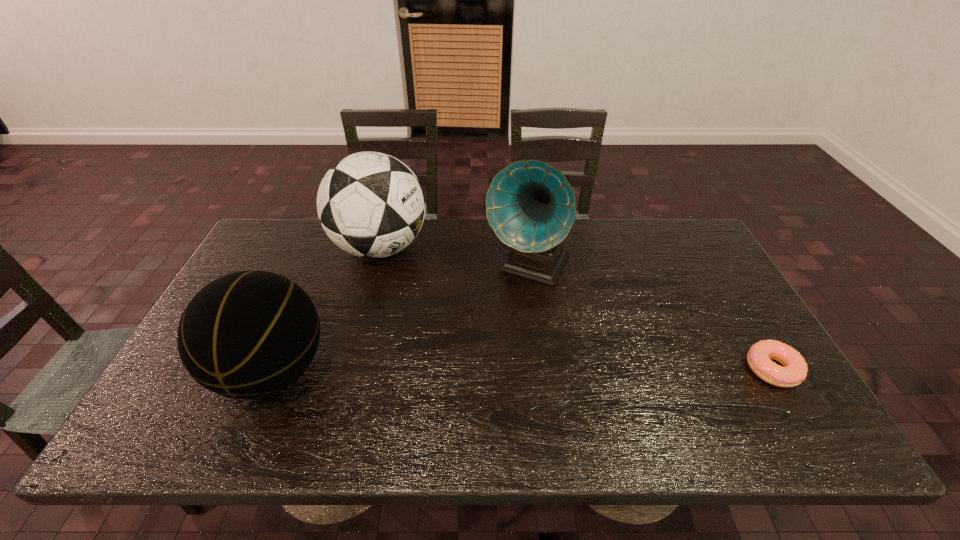
In order to click on free space located 0.260m from the horn of the tallest object in this screenshot , I will do `click(475, 363)`.

You are a GUI agent. You are given a task and a screenshot of the screen. Output one action in this format:
    pyautogui.click(x=<x>, y=<y>)
    Task: Click on the free region located on the surface of the soccer ball where the brand logo is visible
    
    Given the screenshot: What is the action you would take?
    pyautogui.click(x=427, y=312)

Where is `free region located 0.130m on the surface of the soccer ball where the brand logo is visible`? free region located 0.130m on the surface of the soccer ball where the brand logo is visible is located at coordinates (420, 301).

Locate an element on the screen. The image size is (960, 540). free space located 0.300m on the surface of the soccer ball where the brand logo is visible is located at coordinates (448, 340).

This screenshot has width=960, height=540. Identify the location of phonograph_record at the far edge. (530, 205).

Locate an element on the screen. soccer ball that is at the far edge is located at coordinates (371, 205).

Locate an element on the screen. basketball situated at the near edge is located at coordinates (250, 334).

Find the location of `doughnut situated at the near edge`. doughnut situated at the near edge is located at coordinates (794, 371).

What are the coordinates of `object positioned at the left edge` in the screenshot? It's located at (250, 334).

I want to click on object that is at the right edge, so click(x=794, y=371).